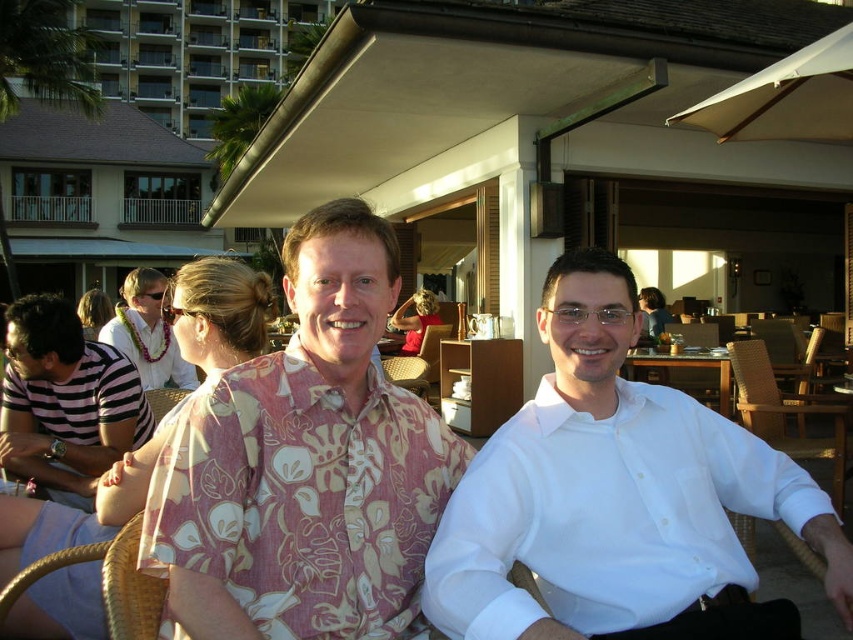
Does floral fabric shirt at center appear on the right side of leather sunglasses at upper center?

Yes, floral fabric shirt at center is to the right of leather sunglasses at upper center.

This screenshot has width=853, height=640. What do you see at coordinates (305, 465) in the screenshot?
I see `floral fabric shirt at center` at bounding box center [305, 465].

You are a GUI agent. You are given a task and a screenshot of the screen. Output one action in this format:
    pyautogui.click(x=<x>, y=<y>)
    Task: Click on the floral fabric shirt at center
    This screenshot has height=640, width=853.
    Given the screenshot: What is the action you would take?
    pyautogui.click(x=305, y=465)

Can you confirm if striped cotton shirt at left is taller than printed fabric shirt at center?

Indeed, striped cotton shirt at left has a greater height compared to printed fabric shirt at center.

Between point (30, 468) and point (126, 288), which one is positioned behind?

Point (126, 288)

You are a GUI agent. You are given a task and a screenshot of the screen. Output one action in this format:
    pyautogui.click(x=<x>, y=<y>)
    Task: Click on the striped cotton shirt at left
    
    Given the screenshot: What is the action you would take?
    pyautogui.click(x=65, y=401)

The image size is (853, 640). Identify the location of striped cotton shirt at left. (65, 401).

The height and width of the screenshot is (640, 853). Describe the element at coordinates (148, 332) in the screenshot. I see `printed fabric shirt at center` at that location.

Is point (142, 275) positioned in front of point (656, 333)?

Yes.

Which is behind, point (103, 328) or point (659, 326)?

Point (659, 326)

The image size is (853, 640). Identify the location of printed fabric shirt at center. (148, 332).